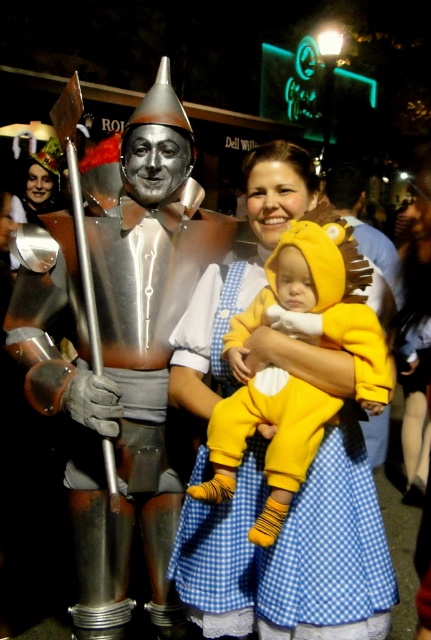
You are standing in the crowd watching the parade and want to take a photo of both the Tin Man and the Cowardly Lion. The Tin Man is at point (75, 250) and the Cowardly Lion is at point (258, 522). Which character should you focus on first to ensure both are in the frame?

You should focus on the Tin Man at point (75, 250) first because it is closer to you than the Cowardly Lion at point (258, 522). This ensures both will be in the frame when you adjust the camera.

Based on the scene description, where exactly is the shiny silver armor at center located in the image?

The shiny silver armor at center is located at point coordinates of (118, 355).

You are a photographer at the event and want to capture a photo of both the shiny silver armor at center and the soft yellow plush at center. However, you need to position yourself so that neither object blocks the other. Where should you stand relative to them?

You should position yourself in front of the shiny silver armor at center so that the soft yellow plush at center, which is behind it, is visible without obstruction. This way, both objects will be in the frame without one blocking the other.